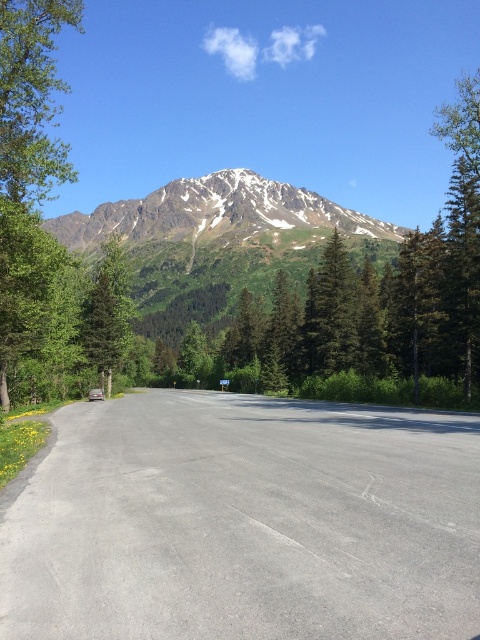
Is snowy granite mountain at upper center positioned in front of green matte tree at left?

No, snowy granite mountain at upper center is behind green matte tree at left.

Who is more forward, (96, 248) or (93, 285)?

Point (93, 285) is in front.

Where is `snowy granite mountain at upper center`? snowy granite mountain at upper center is located at coordinates (218, 216).

Between gray asphalt road at center and green textured tree at center, which one has more height?

With more height is green textured tree at center.

Based on the photo, can you confirm if gray asphalt road at center is thinner than green textured tree at center?

Correct, gray asphalt road at center's width is less than green textured tree at center's.

Is point (437, 552) less distant than point (328, 348)?

That is True.

At what (x,y) coordinates should I click in order to perform the action: click on gray asphalt road at center. Please return your answer as a coordinate pair (x, y). Looking at the image, I should click on (245, 522).

Is snowy granite mountain at upper center above green textured tree at center?

Indeed, snowy granite mountain at upper center is positioned over green textured tree at center.

Which of these two, snowy granite mountain at upper center or green textured tree at center, stands shorter?

green textured tree at center

Which is behind, point (58, 216) or point (336, 353)?

The point (58, 216) is behind.

Identify the location of snowy granite mountain at upper center. (218, 216).